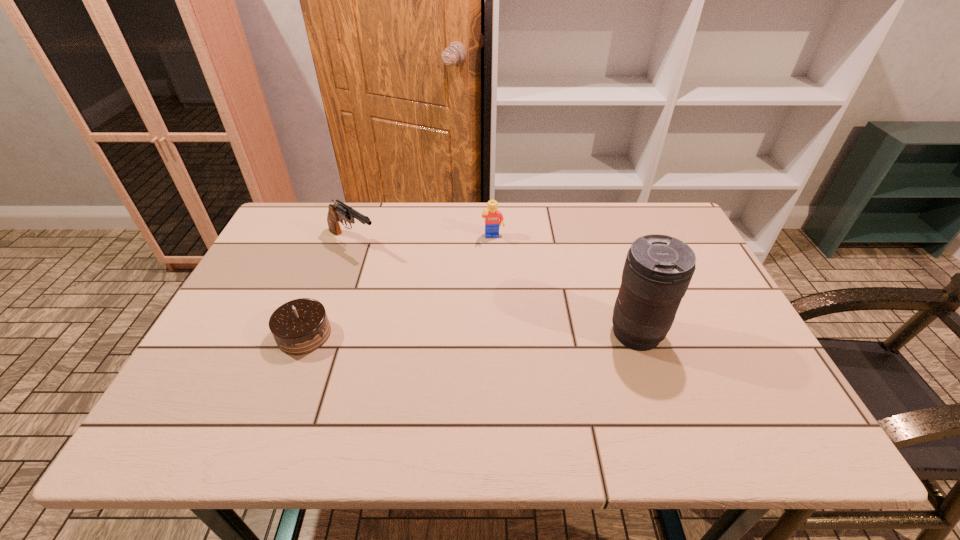
The image size is (960, 540). I want to click on free space at the left edge, so click(267, 327).

This screenshot has height=540, width=960. I want to click on vacant space at the right edge of the desktop, so click(706, 275).

In the image, there is a desktop. At what (x,y) coordinates should I click in order to perform the action: click on free region at the far left corner. Please return your answer as a coordinate pair (x, y). The width and height of the screenshot is (960, 540). Looking at the image, I should click on (319, 210).

I want to click on blank space at the near left corner of the desktop, so click(218, 393).

In the image, there is a desktop. Where is `vacant space at the near right corner`? The width and height of the screenshot is (960, 540). vacant space at the near right corner is located at coordinates (739, 381).

Find the location of a particular element. Image resolution: width=960 pixels, height=540 pixels. vacant space that's between the Lego and the rightmost object is located at coordinates (564, 286).

At what (x,y) coordinates should I click in order to perform the action: click on free point between the gun and the rightmost object. Please return your answer as a coordinate pair (x, y). The height and width of the screenshot is (540, 960). Looking at the image, I should click on (494, 288).

What are the coordinates of `empty space between the gun and the second object from right to left` in the screenshot? It's located at (422, 240).

The image size is (960, 540). I want to click on free spot between the rightmost object and the gun, so click(x=494, y=288).

Where is `vacant space in between the third object from left to right and the shortest object`? The width and height of the screenshot is (960, 540). vacant space in between the third object from left to right and the shortest object is located at coordinates (398, 286).